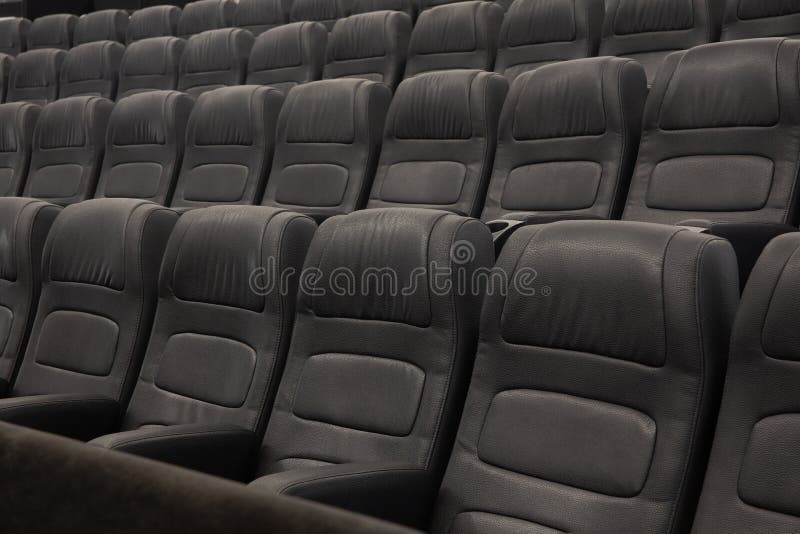
Where is `visible arm rests on theater chairs`? This screenshot has width=800, height=534. visible arm rests on theater chairs is located at coordinates (338, 494), (184, 443), (46, 411), (744, 234), (520, 216), (322, 213), (180, 209).